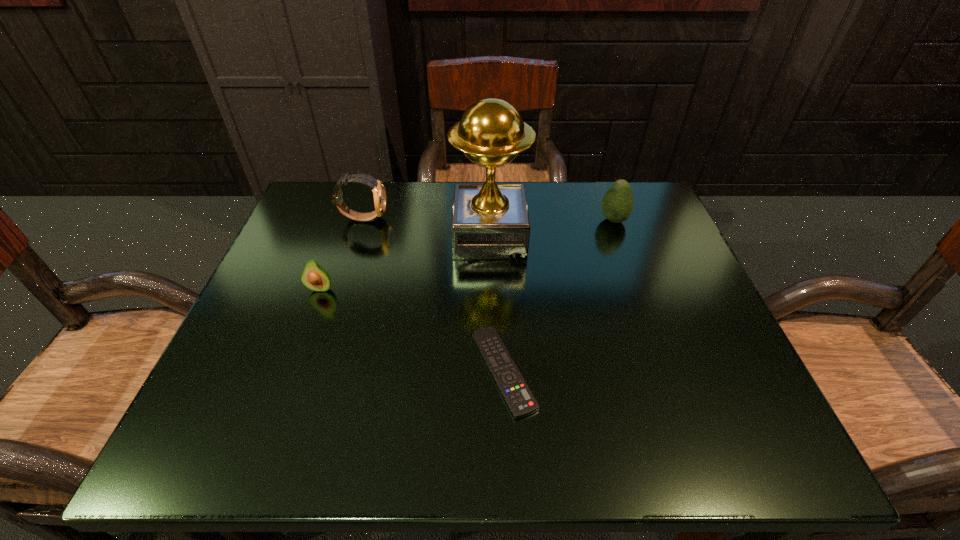
This screenshot has width=960, height=540. Identify the location of object that is the second nearest to the shortest object. (314, 277).

The height and width of the screenshot is (540, 960). I want to click on vacant area in the image that satisfies the following two spatial constraints: 1. on the front side of the taller avocado; 2. on the front-facing side of the award, so click(619, 235).

This screenshot has height=540, width=960. Find the location of `vacant space that satisfies the following two spatial constraints: 1. on the face of the watch; 2. on the left side of the remote control`. vacant space that satisfies the following two spatial constraints: 1. on the face of the watch; 2. on the left side of the remote control is located at coordinates (315, 371).

Identify the location of free spot that satisfies the following two spatial constraints: 1. on the front-facing side of the nearest object; 2. on the right side of the tallest object. The height and width of the screenshot is (540, 960). (493, 371).

The width and height of the screenshot is (960, 540). I want to click on vacant space that satisfies the following two spatial constraints: 1. on the face of the watch; 2. on the left side of the farther avocado, so click(363, 220).

Where is `vacant area in the image that satisfies the following two spatial constraints: 1. on the face of the watch; 2. on the cut side of the shorter avocado`? vacant area in the image that satisfies the following two spatial constraints: 1. on the face of the watch; 2. on the cut side of the shorter avocado is located at coordinates 341,288.

Where is `blank area in the image that satisfies the following two spatial constraints: 1. on the face of the watch; 2. on the back side of the shortest object`? The image size is (960, 540). blank area in the image that satisfies the following two spatial constraints: 1. on the face of the watch; 2. on the back side of the shortest object is located at coordinates (315, 371).

Identify the location of free region that satisfies the following two spatial constraints: 1. on the face of the watch; 2. on the right side of the nearest object. (315, 371).

I want to click on vacant space that satisfies the following two spatial constraints: 1. on the face of the rightmost object; 2. on the right side of the watch, so click(x=363, y=220).

This screenshot has height=540, width=960. What are the coordinates of `blank area in the image that satisfies the following two spatial constraints: 1. on the back side of the remote control; 2. on the face of the watch` in the screenshot? It's located at (496, 218).